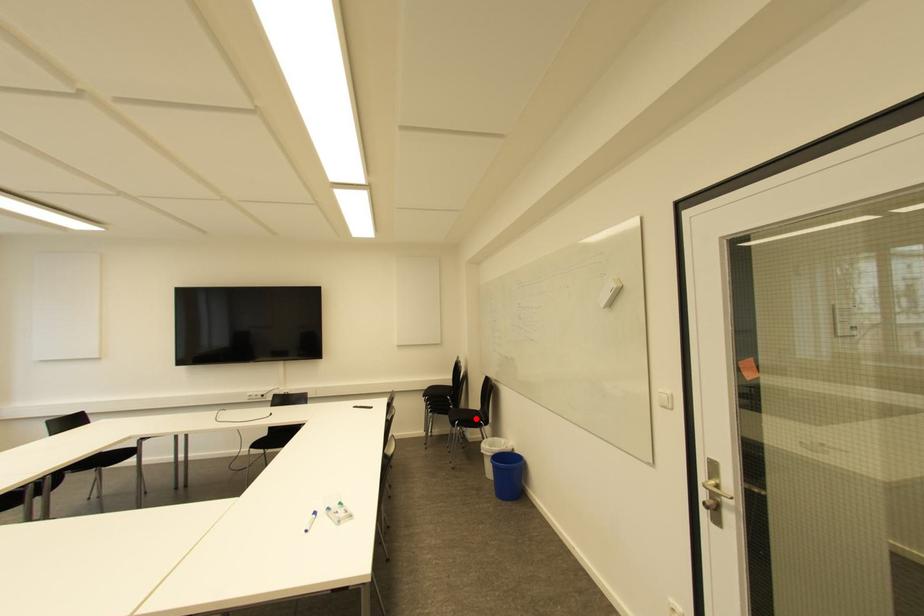
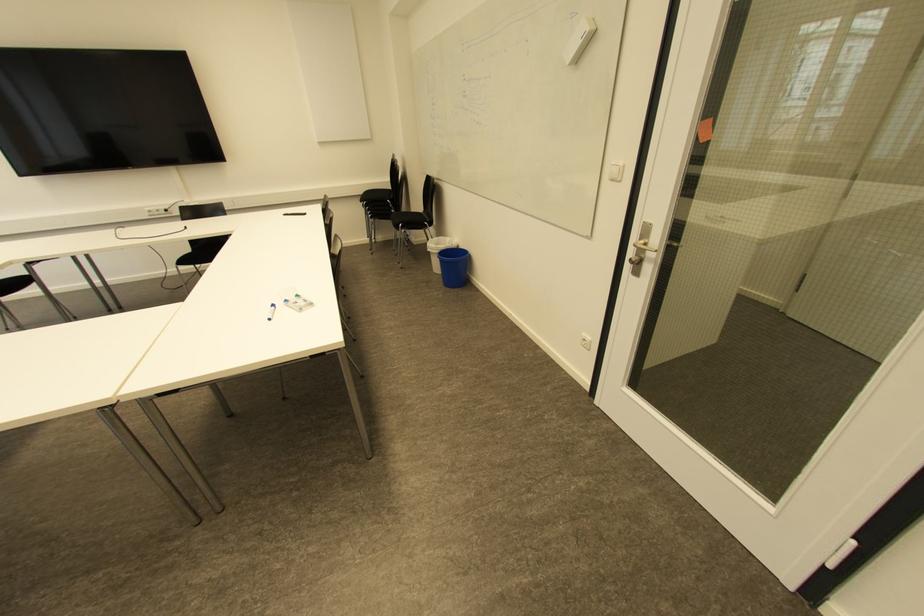
Find the pixel in the second image that matches the highlighted location in the first image.

(419, 222)